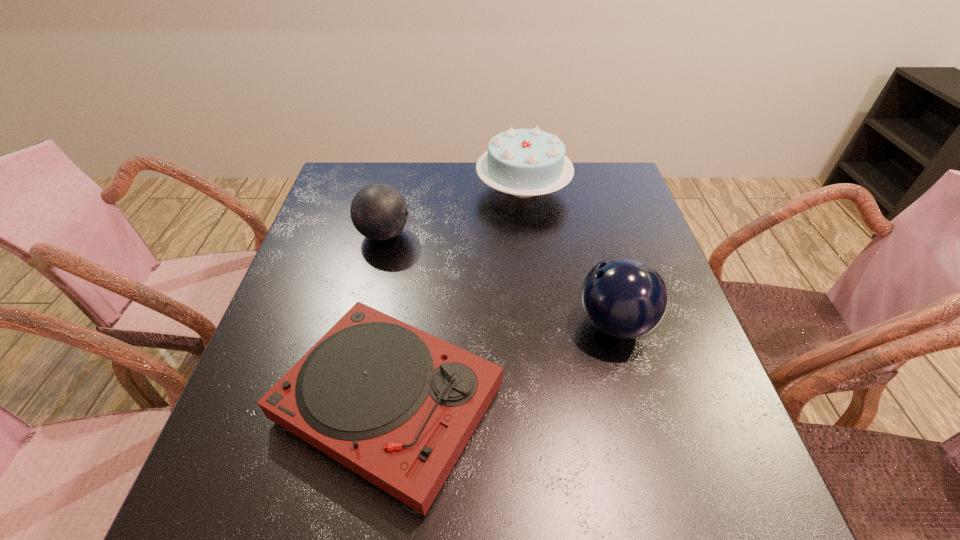
The height and width of the screenshot is (540, 960). What are the coordinates of `free region at the left edge` in the screenshot? It's located at (301, 300).

This screenshot has width=960, height=540. In the image, there is a desktop. Identify the location of vacant area at the right edge. (626, 377).

Locate an element on the screen. The image size is (960, 540). free space at the far left corner of the desktop is located at coordinates (379, 165).

In the image, there is a desktop. At what (x,y) coordinates should I click in order to perform the action: click on vacant region at the near left corner. Please return your answer as a coordinate pair (x, y). Looking at the image, I should click on (224, 495).

In the image, there is a desktop. At what (x,y) coordinates should I click in order to perform the action: click on blank space at the far right corner. Please return your answer as a coordinate pair (x, y). Looking at the image, I should click on (614, 174).

Where is `vacant space in between the farthest object and the nearer bowling ball`? The image size is (960, 540). vacant space in between the farthest object and the nearer bowling ball is located at coordinates (568, 256).

Where is `vacant space that is in between the second farthest object and the nearer bowling ball`? The width and height of the screenshot is (960, 540). vacant space that is in between the second farthest object and the nearer bowling ball is located at coordinates (499, 279).

What are the coordinates of `vacant point located between the nearer bowling ball and the record player` in the screenshot? It's located at (502, 364).

The image size is (960, 540). I want to click on vacant point located between the record player and the farthest object, so click(456, 296).

Identify the location of free spot between the shorter bowling ball and the nearer bowling ball. The height and width of the screenshot is (540, 960). (499, 279).